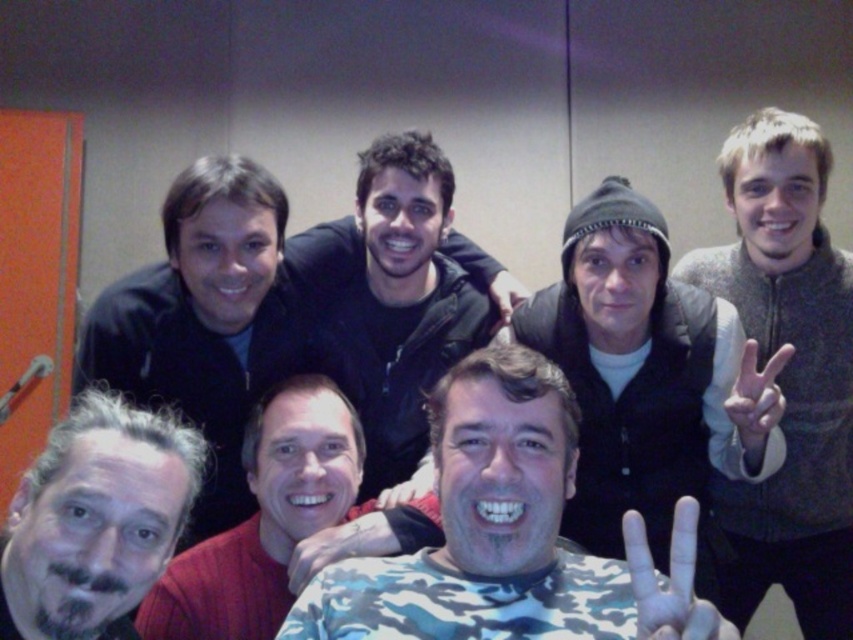
Question: Can you confirm if camouflage shirt at center is positioned to the right of matte black hand at center?

Choices:
 (A) yes
 (B) no

Answer: (B)

Question: Which point is closer to the camera taking this photo?

Choices:
 (A) (642, 576)
 (B) (821, 196)
 (C) (592, 566)
 (D) (375, 224)

Answer: (A)

Question: Which object is farther from the camera taking this photo?

Choices:
 (A) white matte hand at center right
 (B) camouflage fabric shirt at center

Answer: (A)

Question: Is gray sweater at right wider than white matte hand at center?

Choices:
 (A) yes
 (B) no

Answer: (A)

Question: Based on their relative distances, which object is farther from the gray sweater at right?

Choices:
 (A) camouflage fabric shirt at center
 (B) white matte hand at center

Answer: (B)

Question: Considering the relative positions of gray hair at center and camouflage fabric hand at lower center in the image provided, where is gray hair at center located with respect to camouflage fabric hand at lower center?

Choices:
 (A) above
 (B) below

Answer: (A)